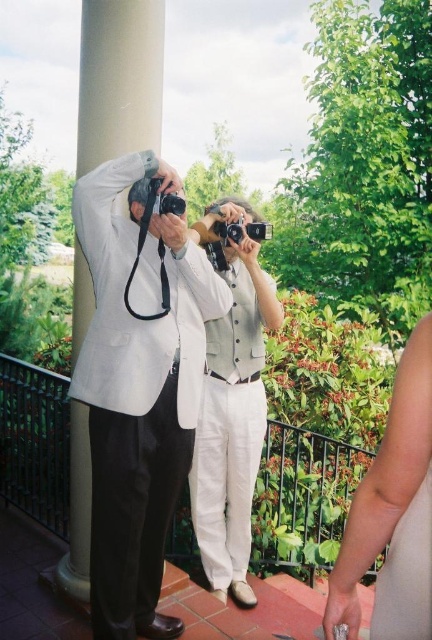
Describe the element at coordinates (118, 77) in the screenshot. This screenshot has width=432, height=640. I see `white smooth pillar at center` at that location.

Is white smooth pillar at center below black plastic camera at center?

Yes.

Does point (123, 33) come farther from viewer compared to point (240, 234)?

No, it is in front of (240, 234).

The image size is (432, 640). What are the coordinates of `white smooth pillar at center` in the screenshot? It's located at (118, 77).

Which is in front, point (187, 349) or point (388, 531)?

Point (388, 531) is in front.

Is matte white suit at left closer to camera compared to smooth beige arm at lower right?

No, matte white suit at left is further to the viewer.

Is point (146, 161) farther from camera compared to point (419, 624)?

That is True.

At what (x,y) coordinates should I click in order to perform the action: click on matte white suit at left. Please return your answer as a coordinate pair (x, y). This screenshot has width=432, height=640. Looking at the image, I should click on (137, 388).

Is point (203, 390) positioned after point (247, 232)?

Yes, it is.

Based on the photo, does light gray cotton vest at center appear on the left side of black plastic camera at center?

Indeed, light gray cotton vest at center is positioned on the left side of black plastic camera at center.

Locate an element on the screen. This screenshot has width=432, height=640. light gray cotton vest at center is located at coordinates (231, 417).